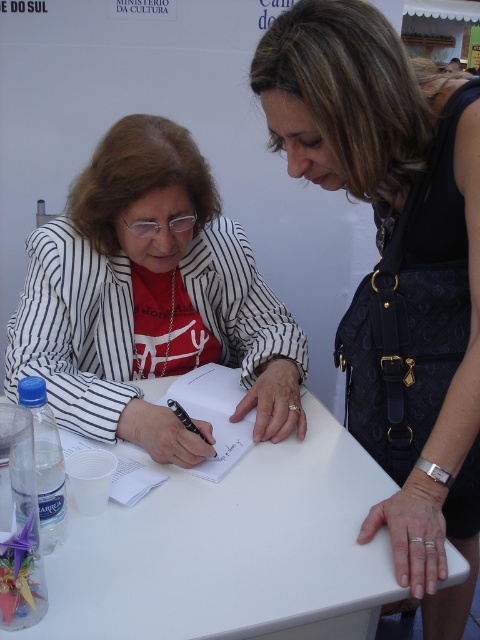
You are a photographer at a signing event. You want to take a photo of the woman writing while ensuring your camera and the black leather handbag at upper right don t block each other. Based on their positions, is there enough space between them to avoid obstruction?

The black leather handbag at upper right and camera are 29.82 inches apart from each other, which is sufficient space to avoid obstruction when taking the photo.

You are an event organizer who needs to place a new item between the black leather handbag at upper right and the black ink pen at center. The item you want to place is 10 cm tall. Can you fit it there based on their heights?

The black leather handbag at upper right is taller than the black ink pen at center. Since the handbag is taller, there is enough vertical space to place the 10 cm tall item between them.